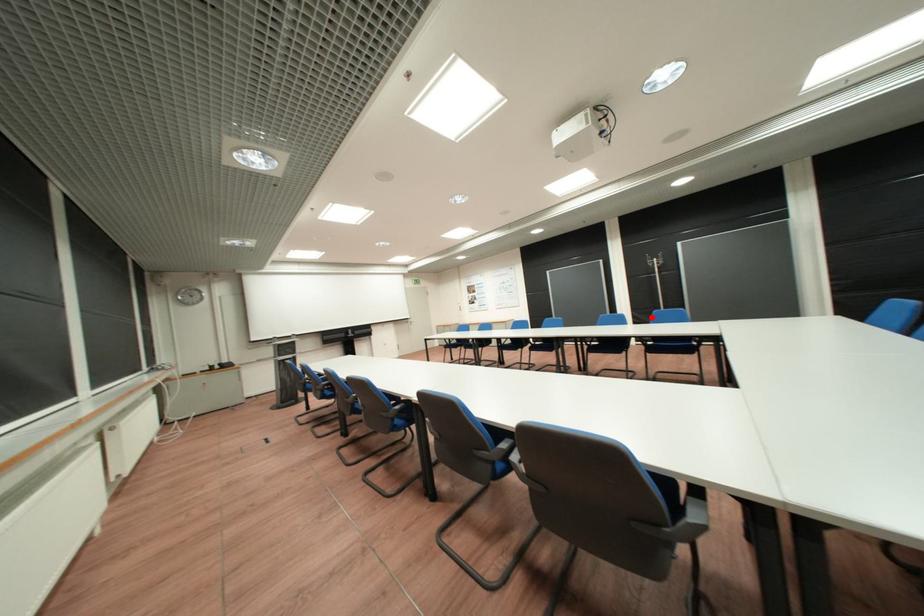
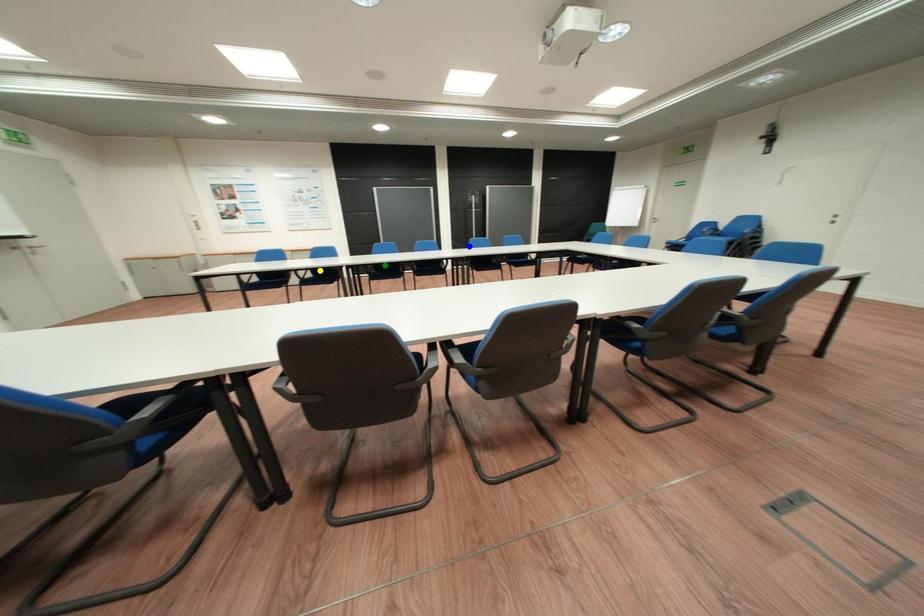
Question: I am providing you with two images of the same scene from different viewpoints. A red point is marked on the first image. You are given multiple points on the second image. Which spot in image 2 lines up with the point in image 1?

Choices:
 (A) blue point
 (B) yellow point
 (C) green point

Answer: (A)